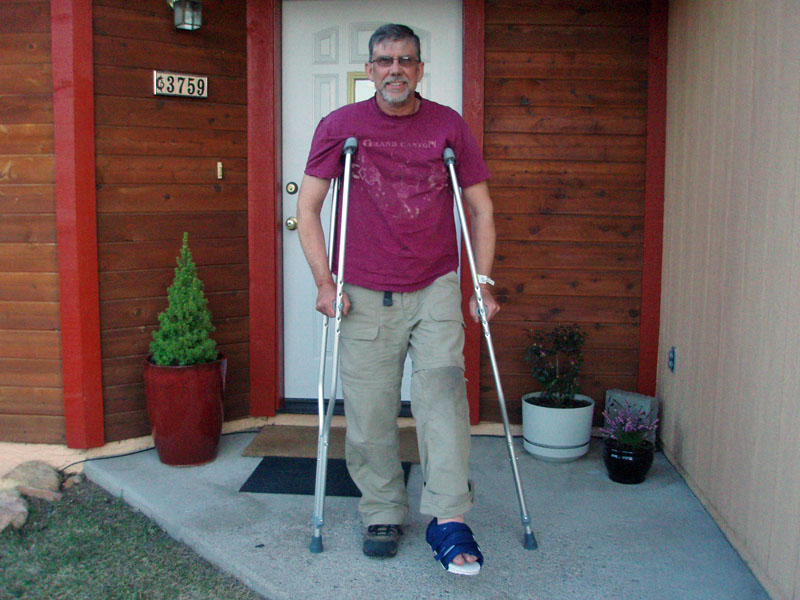
Identify the location of door. (302, 50).